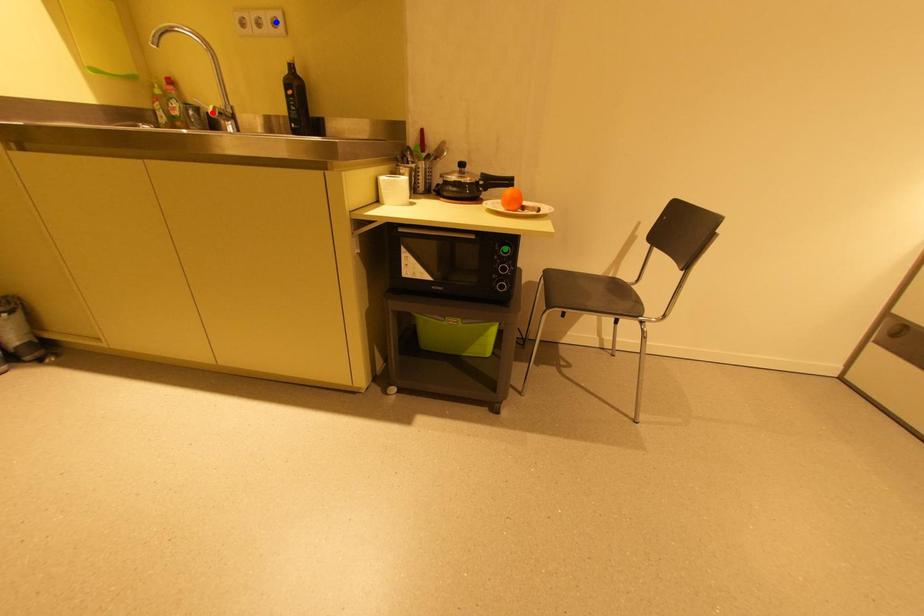
Order these from nearest to farthest:
1. red point
2. green point
3. blue point

green point
blue point
red point